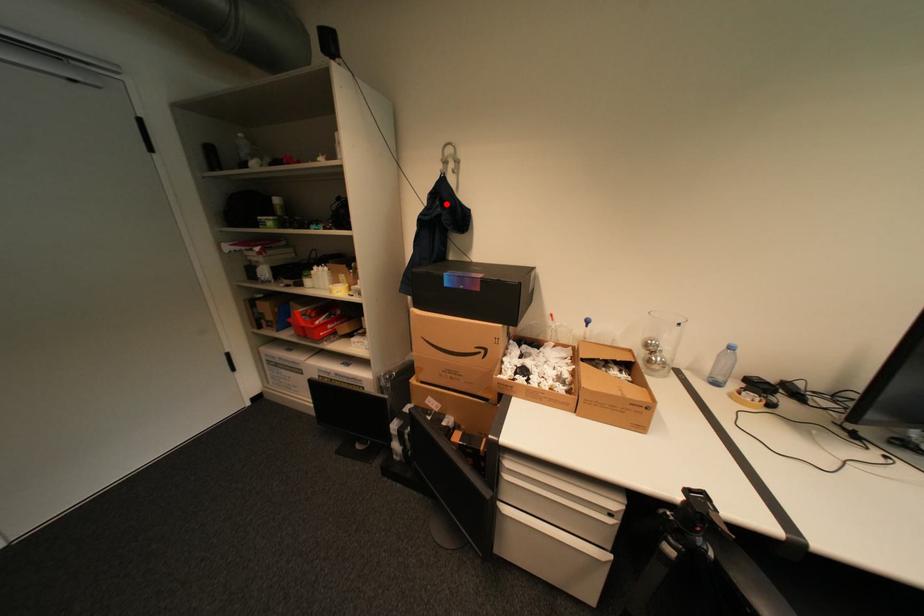
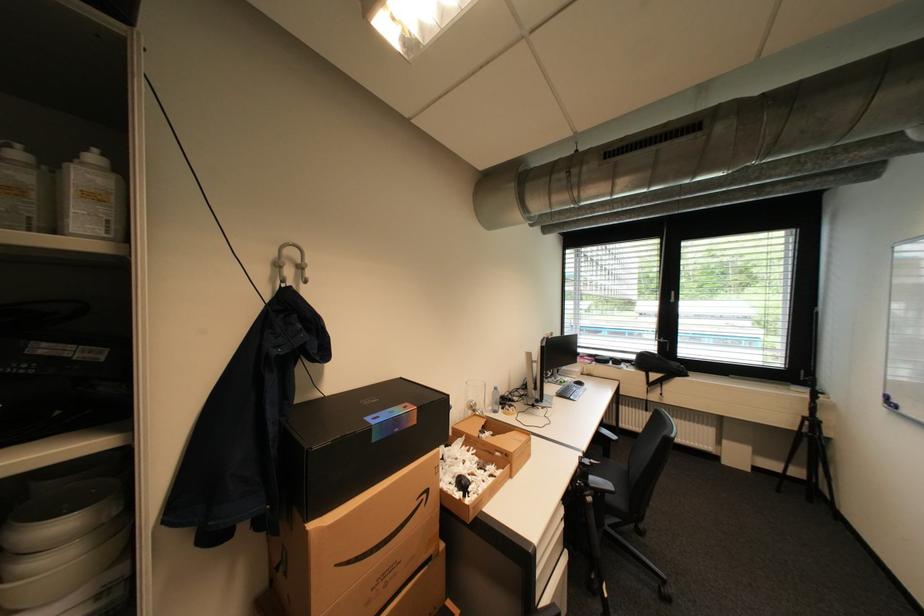
In the second image, find the point that corresponds to the highlighted location in the first image.

(309, 326)